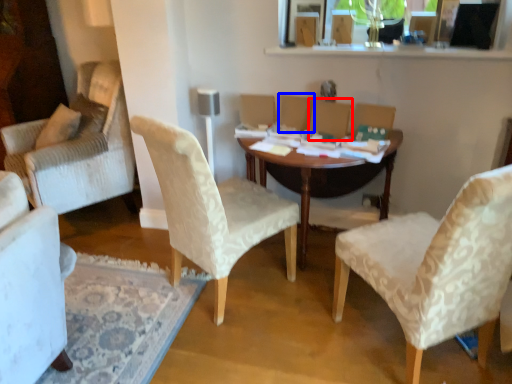
Question: Which point is closer to the camera, armchair (highlighted by a red box) or armchair (highlighted by a blue box)?

Choices:
 (A) armchair
 (B) armchair

Answer: (A)